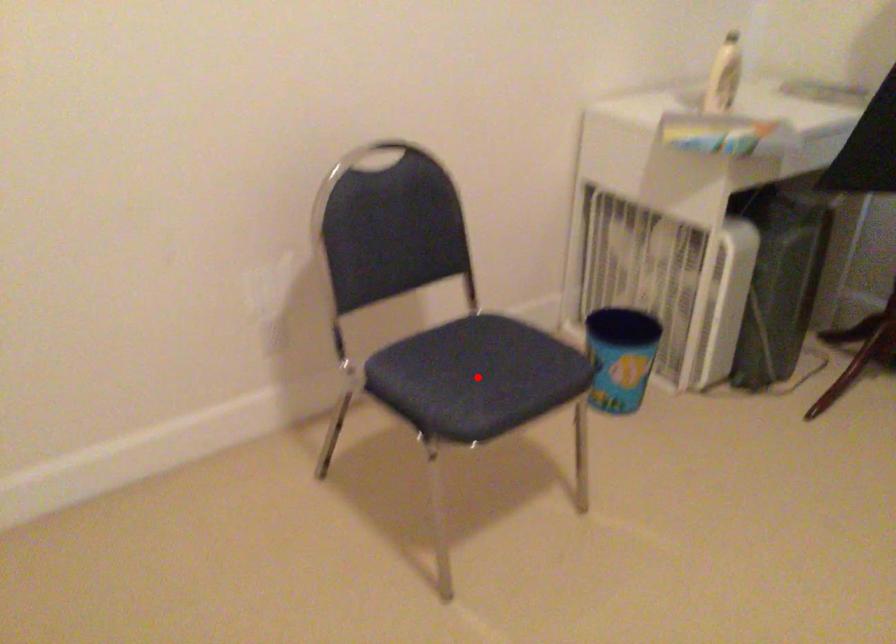
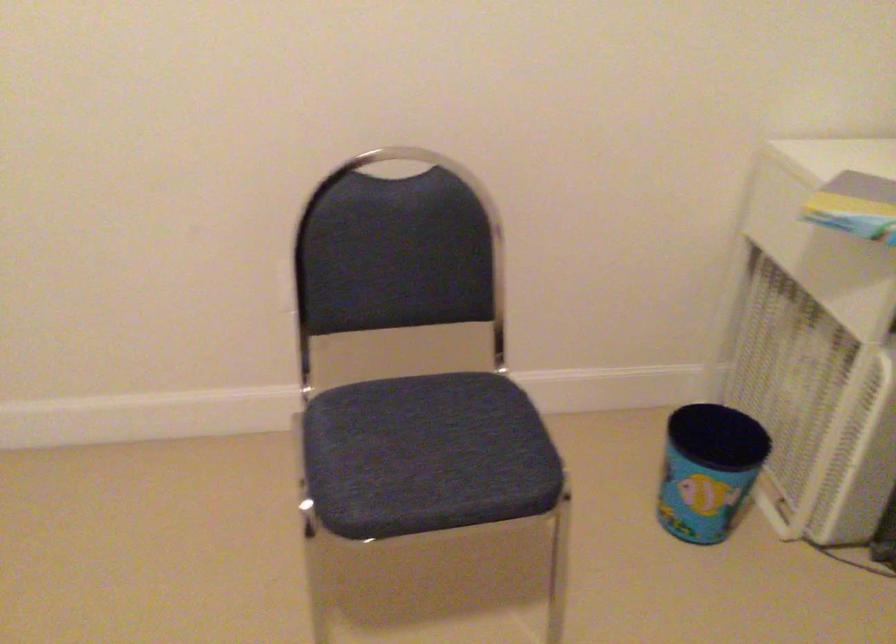
Question: I am providing you with two images of the same scene from different viewpoints. A red point is marked on the first image. Can you still see the location of the red point in image 2?

Choices:
 (A) Yes
 (B) No

Answer: (A)